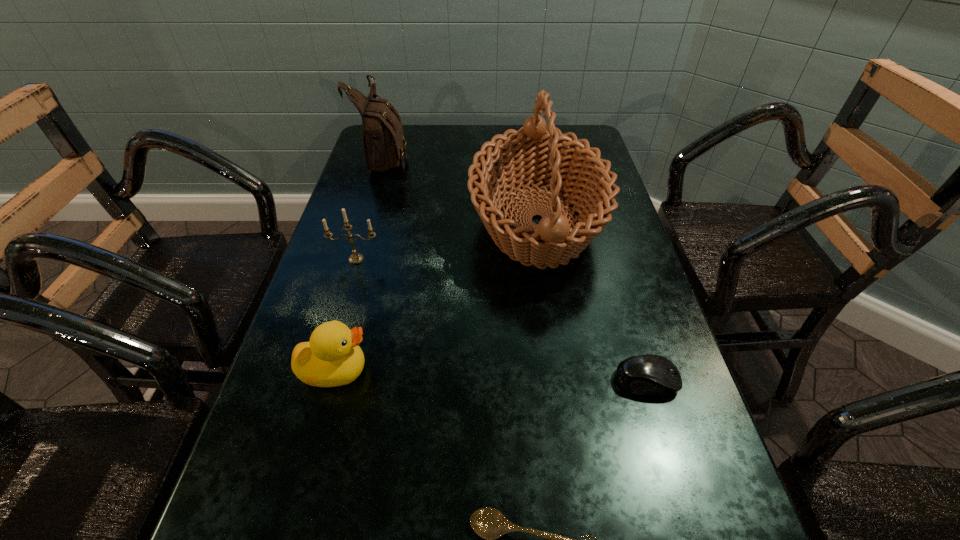
This screenshot has height=540, width=960. What are the coordinates of `the tallest object` in the screenshot? It's located at (536, 154).

This screenshot has height=540, width=960. I want to click on shoulder bag, so click(384, 144).

This screenshot has height=540, width=960. I want to click on candle, so click(355, 258).

This screenshot has width=960, height=540. I want to click on duck, so click(x=332, y=357).

Image resolution: width=960 pixels, height=540 pixels. I want to click on the second shortest object, so click(646, 374).

You are a GUI agent. You are given a task and a screenshot of the screen. Output one action in this format:
    pyautogui.click(x=<x>, y=<y>)
    Task: Click on the vacant space located 0.310m on the front of the basket
    
    Given the screenshot: What is the action you would take?
    pyautogui.click(x=568, y=431)

Where is `blank space located 0.100m on the front-facing side of the fifth shortest object`? The width and height of the screenshot is (960, 540). blank space located 0.100m on the front-facing side of the fifth shortest object is located at coordinates (441, 156).

I want to click on free space located 0.350m on the right of the candle, so click(530, 259).

You are a GUI agent. You are given a task and a screenshot of the screen. Output one action in this format:
    pyautogui.click(x=<x>, y=<y>)
    Task: Click on the free region located at the beak of the third shortest object
    The image size is (960, 540).
    Given the screenshot: What is the action you would take?
    pyautogui.click(x=473, y=371)

You are a GUI agent. You are given a task and a screenshot of the screen. Output one action in this format:
    pyautogui.click(x=<x>, y=<y>)
    Task: Click on the vacant space located on the front of the second shortest object
    
    Given the screenshot: What is the action you would take?
    pyautogui.click(x=692, y=530)